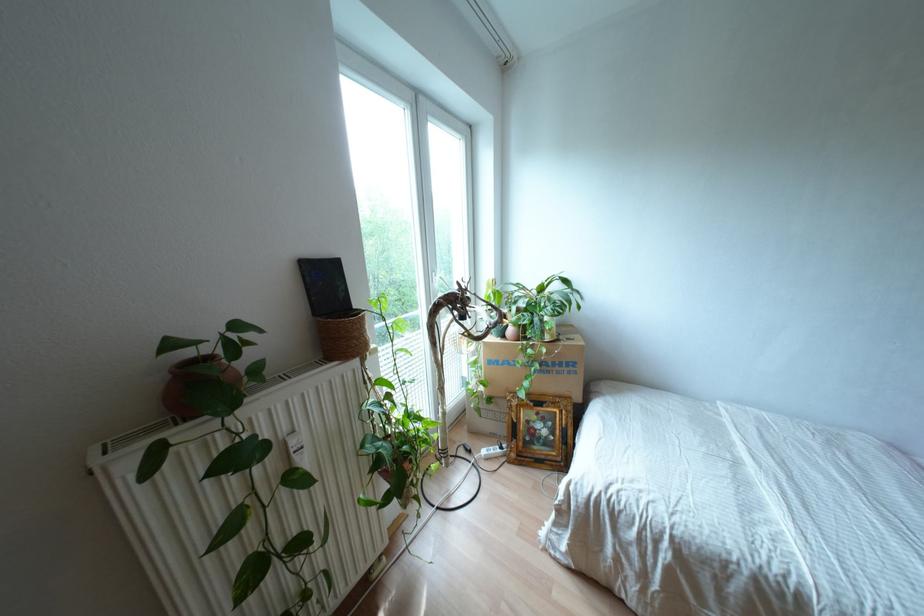
Find where to push the white electrical plug. Please return your answer as a coordinate pair (x, y).

(492, 451)